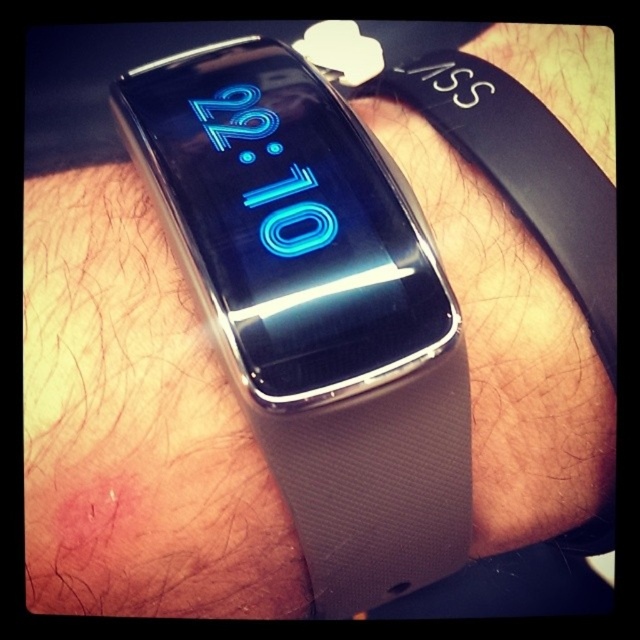
You are examining a smartwatch on a wrist. You notice two points marked on the watch face. The first point is at coordinates point (273, 163) and the second is at point (592, 163). Which point is nearer to you when looking at the watch?

Point (273, 163) is closer to the viewer than point (592, 163).

You are trying to decide which item to use for a craft project. You have two white fabric items on your desk, a white fabric band at center and a white fabric wristband at center. Which one has a greater height?

The white fabric band at center is much taller than the white fabric wristband at center, so the white fabric band at center has a greater height.

Consider the image. You are trying to decide which of the two white fabric items on the wrist is wider. You see the white fabric band at center and the white fabric wristband at center. Which one has a greater width?

The white fabric band at center has a greater width than the white fabric wristband at center according to the description.